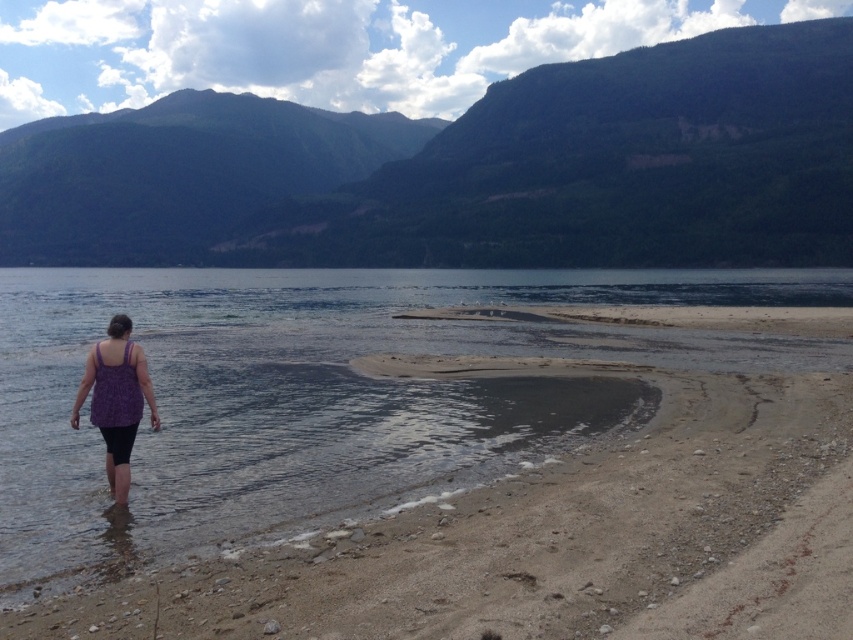
Can you confirm if sandy beach at lower left is bigger than purple fabric tank top at lower left?

Yes, sandy beach at lower left is bigger than purple fabric tank top at lower left.

Based on the photo, which of these two, sandy beach at lower left or purple fabric tank top at lower left, stands taller?

With more height is purple fabric tank top at lower left.

This screenshot has height=640, width=853. Describe the element at coordinates (550, 536) in the screenshot. I see `sandy beach at lower left` at that location.

The height and width of the screenshot is (640, 853). Identify the location of sandy beach at lower left. (550, 536).

From the picture: Is green forested mountain at upper center taller than sandy beach at lower left?

Indeed, green forested mountain at upper center has a greater height compared to sandy beach at lower left.

The width and height of the screenshot is (853, 640). Identify the location of green forested mountain at upper center. (469, 170).

This screenshot has width=853, height=640. I want to click on green forested mountain at upper center, so click(x=469, y=170).

Between green forested mountain at upper center and purple fabric tank top at lower left, which one appears on the right side from the viewer's perspective?

purple fabric tank top at lower left is more to the right.

The width and height of the screenshot is (853, 640). Identify the location of green forested mountain at upper center. (469, 170).

Where is `green forested mountain at upper center`? The image size is (853, 640). green forested mountain at upper center is located at coordinates (469, 170).